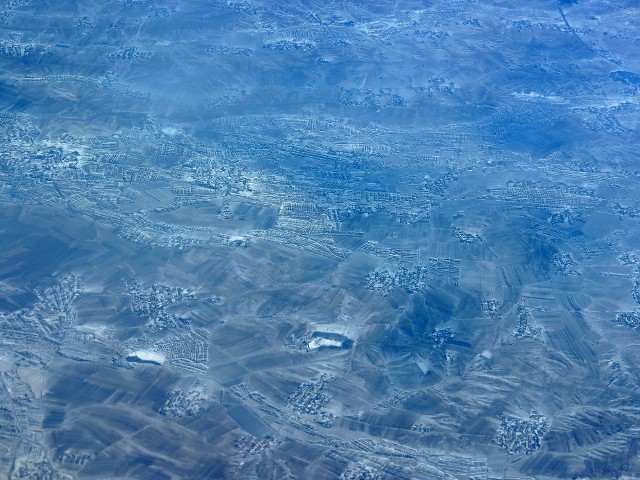
Locate an element on the screen. picture is located at coordinates (333, 218).